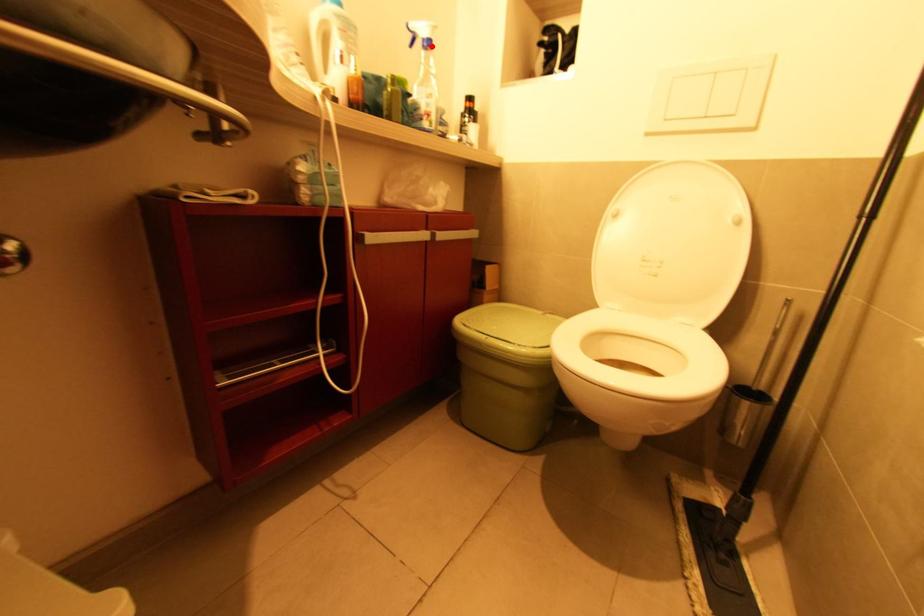
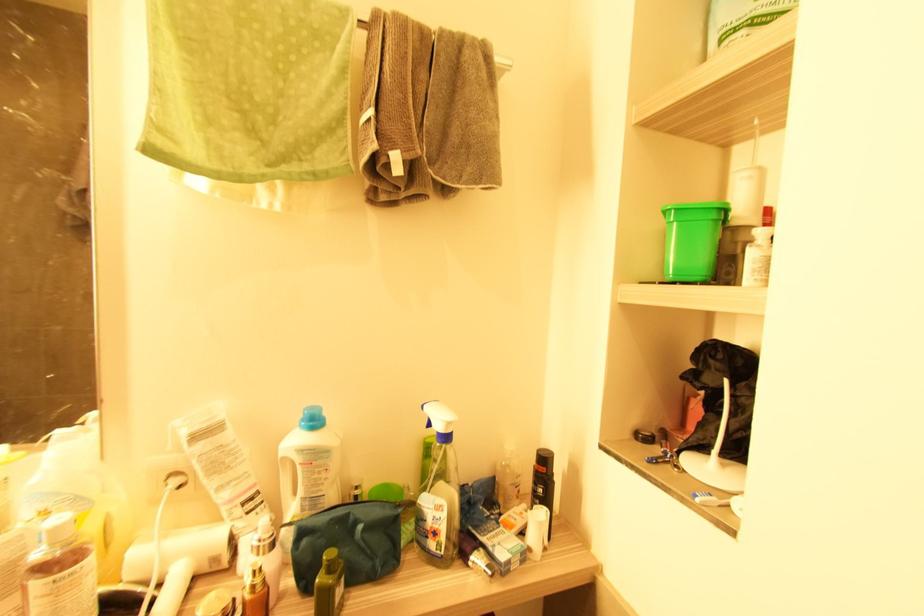
Locate, in the second image, the point that corresponds to the highlighted location in the first image.

(447, 438)